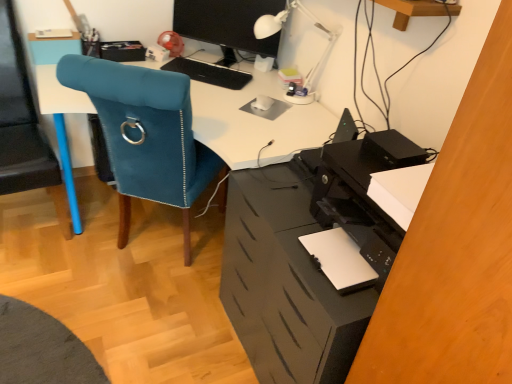
Where is `free spot below blue fabric chair at left (from a real-world perspective)`? free spot below blue fabric chair at left (from a real-world perspective) is located at coordinates (32, 210).